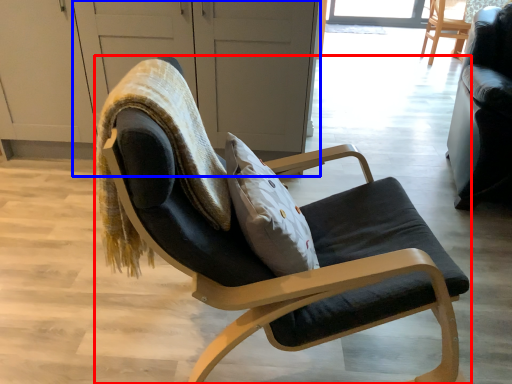
Question: Which of the following is the farthest to the observer, chair (highlighted by a red box) or screen door (highlighted by a blue box)?

Choices:
 (A) chair
 (B) screen door

Answer: (B)